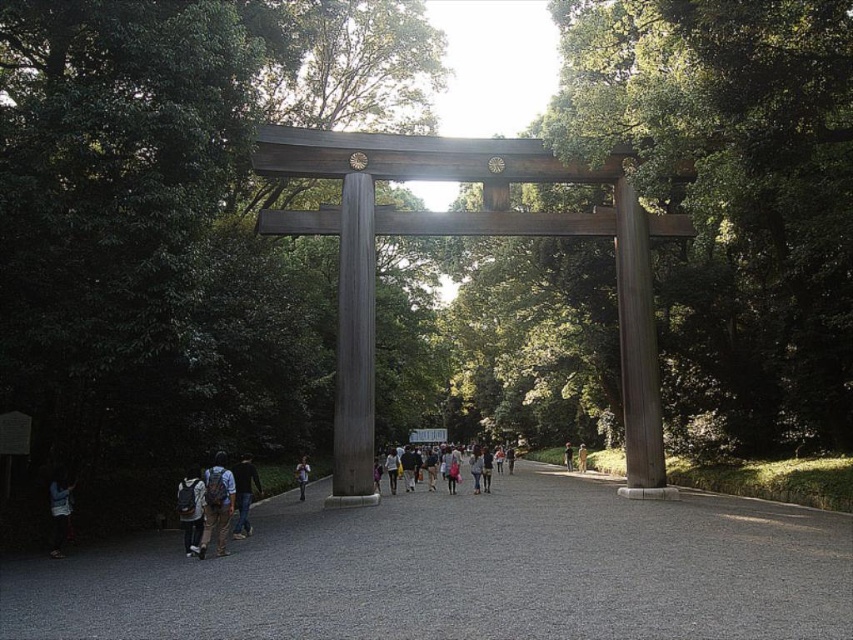
Between gray asphalt path at center and denim jeans at center, which one has more height?

gray asphalt path at center

Identify the location of gray asphalt path at center. The image size is (853, 640). (465, 572).

At what (x,y) coordinates should I click in order to perform the action: click on gray asphalt path at center. Please return your answer as a coordinate pair (x, y). Looking at the image, I should click on (465, 572).

Is denim jeans at center to the left of dark brown wooden post at center from the viewer's perspective?

Indeed, denim jeans at center is positioned on the left side of dark brown wooden post at center.

What do you see at coordinates (244, 493) in the screenshot? I see `denim jeans at center` at bounding box center [244, 493].

You are a GUI agent. You are given a task and a screenshot of the screen. Output one action in this format:
    pyautogui.click(x=<x>, y=<y>)
    Task: Click on the denim jeans at center
    
    Given the screenshot: What is the action you would take?
    pyautogui.click(x=244, y=493)

Who is positioned more to the left, matte gray backpack at lower left or denim jeans at center?

matte gray backpack at lower left is more to the left.

Can you confirm if matte gray backpack at lower left is thinner than denim jeans at center?

Incorrect, matte gray backpack at lower left's width is not less than denim jeans at center's.

Who is more forward, (183, 499) or (236, 506)?

Point (183, 499) is in front.

Find the location of a particular element. matte gray backpack at lower left is located at coordinates (190, 509).